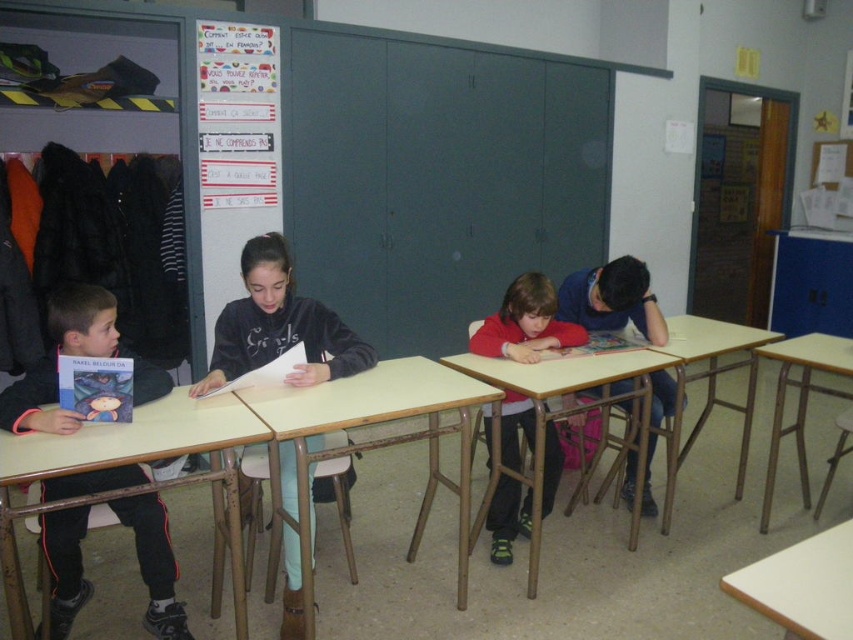
You are a student who needs to put on your matte black hoodie at center before leaving the classroom. The wooden table at lower right is blocking your path to the door. Can you move around the table to reach your hoodie?

The matte black hoodie at center is to the left of the wooden table at lower right, so you can move around the table to the left side to reach your hoodie.

You are a student in the classroom and want to retrieve your matte black hoodie at center. The wooden table at lower right has your notebook on it. To reach your hoodie first, which object should you move closer to?

You should move closer to the matte black hoodie at center because it is in front of the wooden table at lower right, meaning it is closer to you.